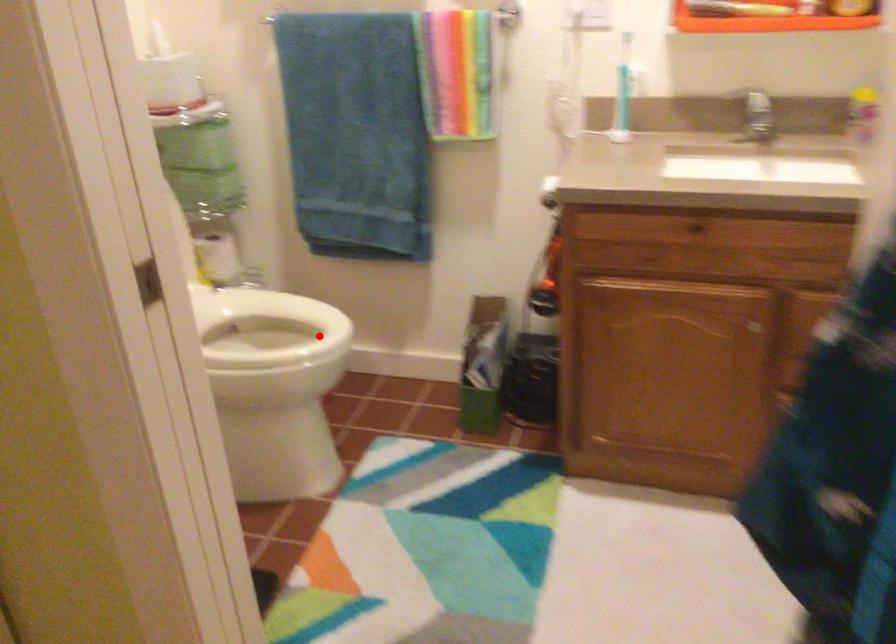
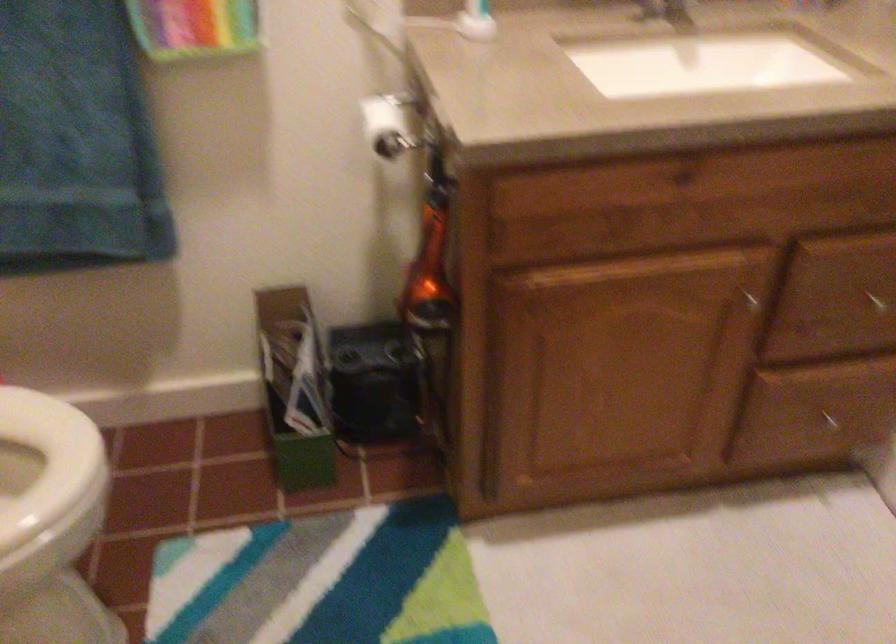
The point at the highlighted location is marked in the first image. Where is the corresponding point in the second image?

(47, 466)